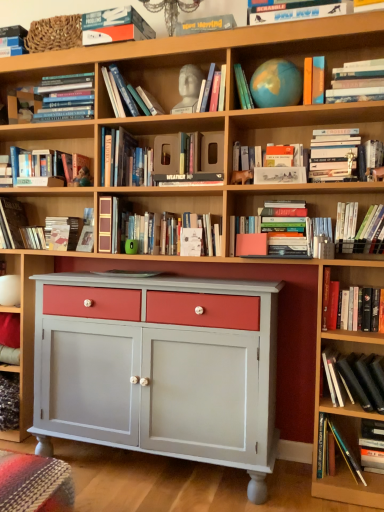
Question: Is matte blue globe at upper center, which ranks as the eleventh book in bottom-to-top order, to the right of hardcover book at upper right, the seventh book ordered from the bottom, from the viewer's perspective?

Choices:
 (A) no
 (B) yes

Answer: (A)

Question: Is matte blue globe at upper center, which is the 6th book from top to bottom, at the left side of hardcover book at upper right, the seventh book ordered from the bottom?

Choices:
 (A) yes
 (B) no

Answer: (A)

Question: From a real-world perspective, is matte blue globe at upper center, which is the 6th book from top to bottom, positioned under hardcover book at upper right, positioned as the 10th book in top-to-bottom order, based on gravity?

Choices:
 (A) yes
 (B) no

Answer: (B)

Question: From a real-world perspective, is matte blue globe at upper center, which ranks as the eleventh book in bottom-to-top order, on hardcover book at upper right, positioned as the 10th book in top-to-bottom order?

Choices:
 (A) yes
 (B) no

Answer: (A)

Question: Is matte blue globe at upper center, which ranks as the eleventh book in bottom-to-top order, completely or partially outside of hardcover book at upper right, the seventh book ordered from the bottom?

Choices:
 (A) yes
 (B) no

Answer: (A)

Question: Relative to matte blue globe at upper center, which is the 6th book from top to bottom, is black matte book at lower right, the fourteenth book viewed from the top, in front or behind?

Choices:
 (A) behind
 (B) front

Answer: (B)

Question: Looking at their shapes, would you say black matte book at lower right, the fourteenth book viewed from the top, is wider or thinner than matte blue globe at upper center, which is the 6th book from top to bottom?

Choices:
 (A) thin
 (B) wide

Answer: (B)

Question: From a real-world perspective, is black matte book at lower right, placed as the third book when sorted from bottom to top, above or below matte blue globe at upper center, which ranks as the eleventh book in bottom-to-top order?

Choices:
 (A) below
 (B) above

Answer: (A)

Question: From the image's perspective, is black matte book at lower right, placed as the third book when sorted from bottom to top, positioned above or below matte blue globe at upper center, which ranks as the eleventh book in bottom-to-top order?

Choices:
 (A) above
 (B) below

Answer: (B)

Question: From a real-world perspective, relative to orange matte book at upper right, the 7th book when ordered from top to bottom, is white paper at center vertically above or below?

Choices:
 (A) above
 (B) below

Answer: (B)

Question: From their relative heights in the image, would you say white paper at center is taller or shorter than orange matte book at upper right, the tenth book from the bottom?

Choices:
 (A) short
 (B) tall

Answer: (A)

Question: Looking at the image, does white paper at center seem bigger or smaller compared to orange matte book at upper right, the tenth book from the bottom?

Choices:
 (A) small
 (B) big

Answer: (A)

Question: Considering the positions of white paper at center and orange matte book at upper right, the 7th book when ordered from top to bottom, in the image, is white paper at center wider or thinner than orange matte book at upper right, the 7th book when ordered from top to bottom,?

Choices:
 (A) thin
 (B) wide

Answer: (A)

Question: From the image's perspective, is hardcover books at upper center, which is the 3th book from top to bottom, positioned above or below white paper at center?

Choices:
 (A) above
 (B) below

Answer: (A)

Question: Would you say hardcover books at upper center, the fourteenth book in the bottom-to-top sequence, is to the left or to the right of white paper at center in the picture?

Choices:
 (A) right
 (B) left

Answer: (B)